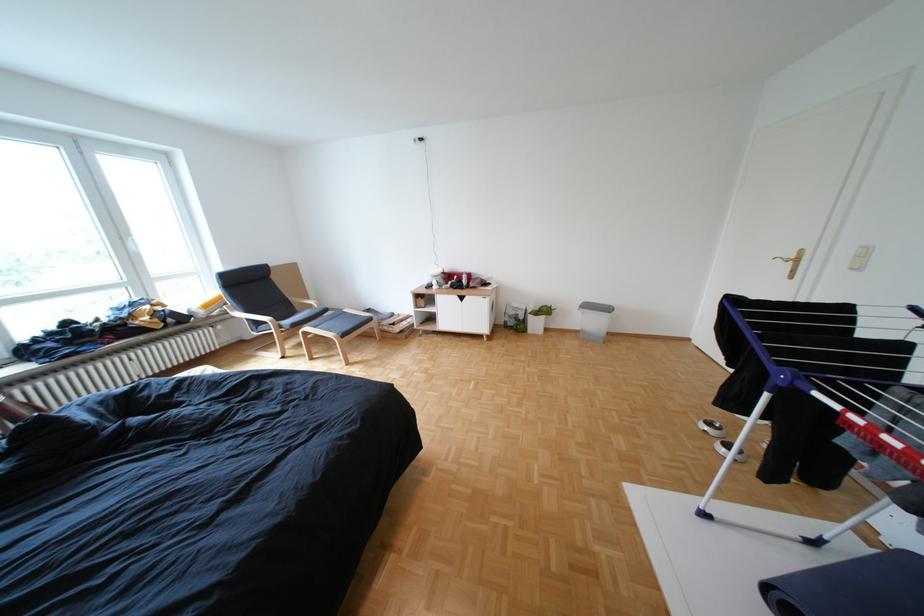
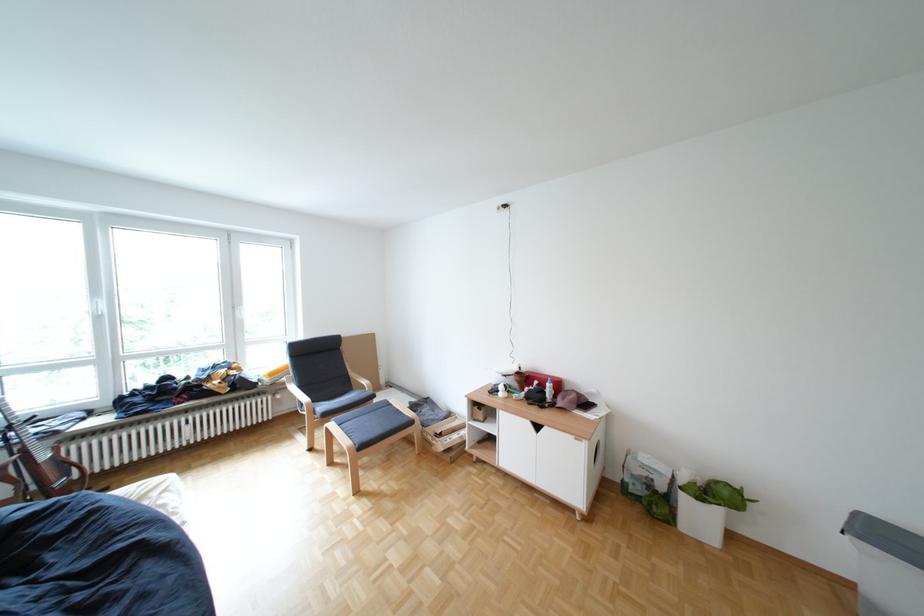
Find the pixel in the second image that matches point 222,307 in the first image.

(286, 374)